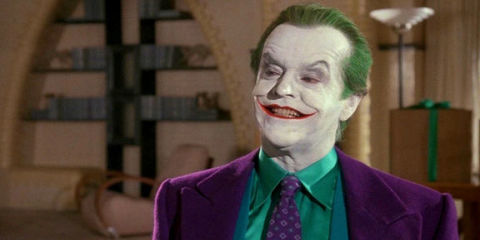
Where is `wall`? wall is located at coordinates (242, 15), (16, 18).